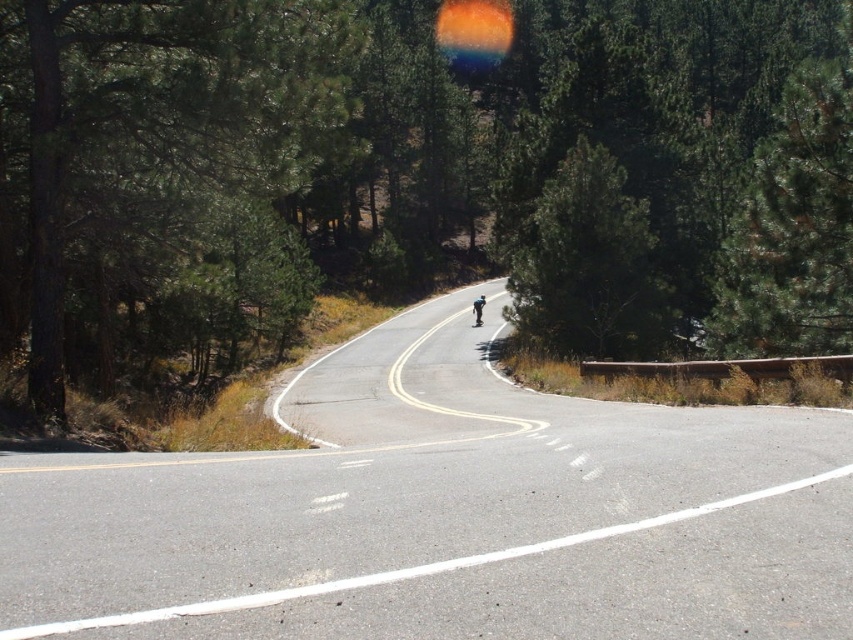
Question: Among these points, which one is farthest from the camera?

Choices:
 (A) (86, 339)
 (B) (474, 316)
 (C) (776, 545)

Answer: (B)

Question: Among these objects, which one is nearest to the camera?

Choices:
 (A) green matte tree at left
 (B) asphalt road at left
 (C) blue glossy skateboard at center

Answer: (B)

Question: Is green leafy tree at center further to camera compared to asphalt road at left?

Choices:
 (A) no
 (B) yes

Answer: (B)

Question: Can you confirm if asphalt road at left is positioned below green matte tree at left?

Choices:
 (A) yes
 (B) no

Answer: (A)

Question: Is green matte tree at left closer to the viewer compared to blue glossy skateboard at center?

Choices:
 (A) yes
 (B) no

Answer: (A)

Question: Which is farther from the asphalt road at left?

Choices:
 (A) green leafy tree at center
 (B) blue glossy skateboard at center

Answer: (A)